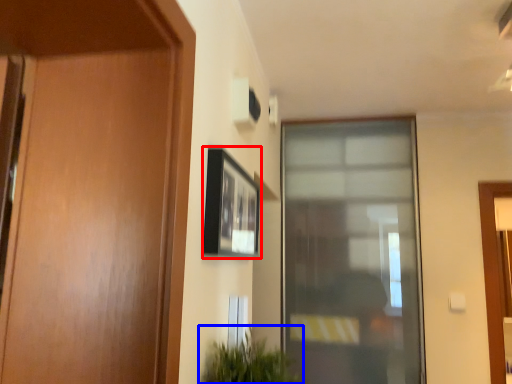
Question: Among these objects, which one is farthest to the camera, picture frame (highlighted by a red box) or houseplant (highlighted by a blue box)?

Choices:
 (A) picture frame
 (B) houseplant

Answer: (A)